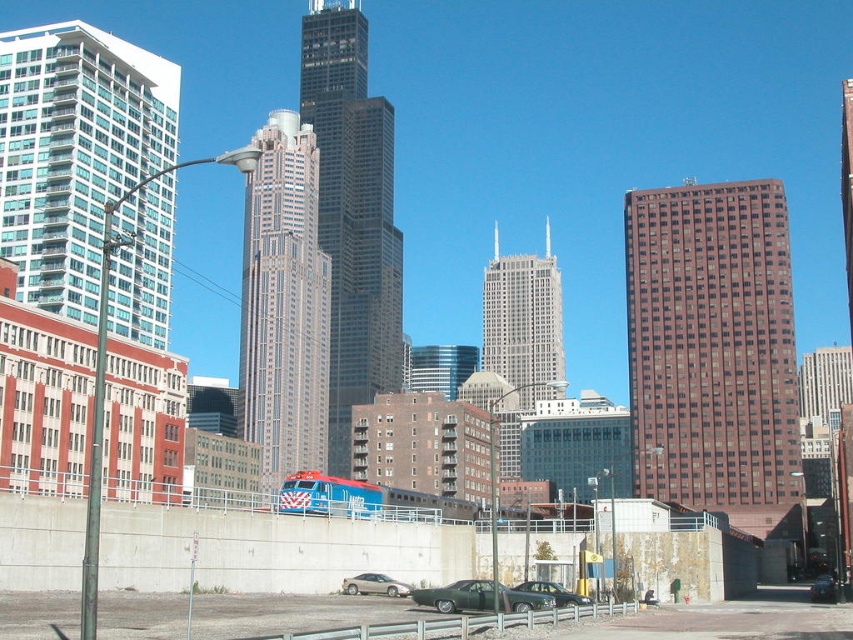
You are standing at the point with coordinates point [711,344]. Looking around, you see a brown glass building at right. Which direction should you face to see the brown glass building at right?

You should face to the right to see the brown glass building at right as the point [711,344] corresponds to it.

You are a pedestrian standing at the edge of the street. You see a silver metallic sedan at lower center and a shiny black sedan at center. Which car is nearer to you?

The silver metallic sedan at lower center is closer to the viewer than the shiny black sedan at center, so the silver metallic sedan at lower center is nearer to you.

You are standing at the center of the image and want to locate the brown glass building at right. Based on the coordinates provided, in which direction should you turn to face it?

The brown glass building at right is located at coordinates point (x=711, y=344). Since the x coordinate is 0.539, which is slightly to the right of center, you should turn to your right to face the brown glass building at right.